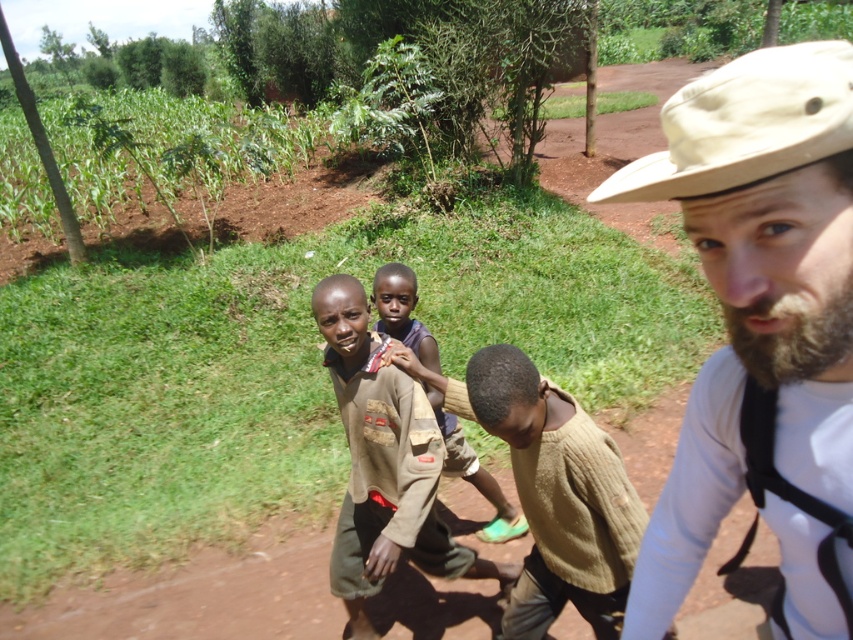
Question: Can you confirm if beige fabric hat at upper right is bigger than brown soil at center?

Choices:
 (A) no
 (B) yes

Answer: (A)

Question: Is beige fabric hat at upper right bigger than knitted beige sweater at center?

Choices:
 (A) yes
 (B) no

Answer: (B)

Question: Which point is closer to the camera?

Choices:
 (A) knitted beige sweater at center
 (B) brown knitted sweater at center
 (C) beige fabric hat at upper right

Answer: (C)

Question: Does beige fabric hat at upper right appear on the left side of brown knitted sweater at center?

Choices:
 (A) no
 (B) yes

Answer: (A)

Question: Which point is farther from the camera taking this photo?

Choices:
 (A) (589, 564)
 (B) (764, 173)
 (C) (300, 176)
 (D) (413, 300)

Answer: (C)

Question: Which object is closer to the camera taking this photo?

Choices:
 (A) brown soil at center
 (B) brown knitted sweater at center
 (C) knitted beige sweater at center
 (D) beige fabric hat at upper right

Answer: (D)